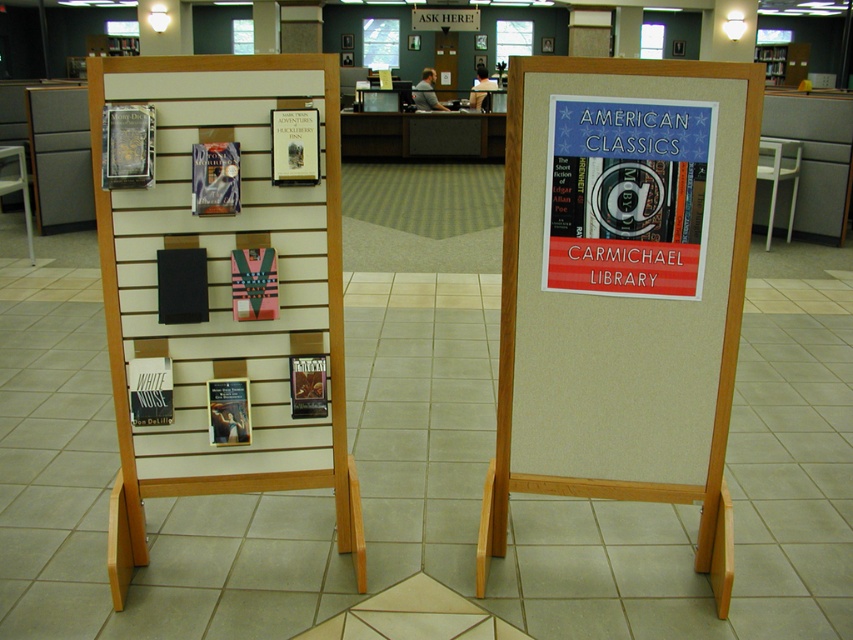
You are a librarian who needs to place a new book on the display. The new book is exactly 1 foot thick. The space between the white matte book at center and the nearest book on the slatted wooden rack is 1.2 feet. Can the new book fit in that space?

The space between the white matte book at center and the nearest book on the slatted wooden rack is 1.2 feet. Since the new book is 1 foot thick, it can fit in the space as 1 foot is less than 1.2 feet.

You are a librarian organizing books in the library. You need to place a new book on the shelf. The wooden slat wall at left and the hardcover book at upper center are in your way. Which one should you move first to access the shelf behind them?

The wooden slat wall at left is positioned on the left side of hardcover book at upper center, so you should move the wooden slat wall at left first because it is closer to you and blocking access to the shelf behind both objects.

What is the spatial relationship between the metallic silver book at center and the metal at left in the library scene? Please describe their positions relative to each other based on their distance from the viewer.

The metallic silver book at center is closer to the viewer than the metal at left.